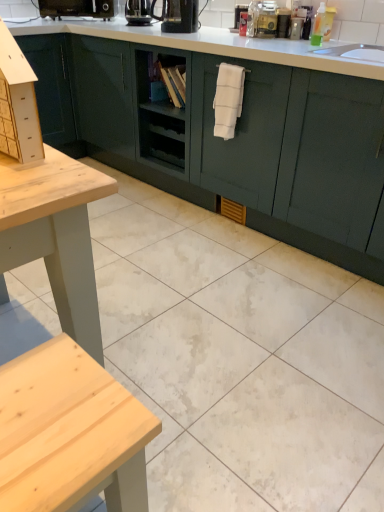
The height and width of the screenshot is (512, 384). I want to click on free space that is to the left of translucent plastic bottle at upper right, so click(x=289, y=40).